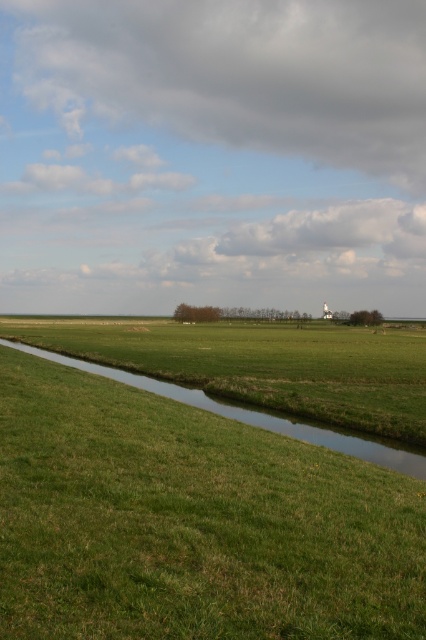
You are standing in the rural landscape and want to walk from the point at coordinates point (23, 420) to the point at coordinates point (169, 394). Considering the terrain described, will you have to climb uphill or downhill along the way?

Since point (23, 420) is in front of point (169, 394), you will be moving towards a higher elevation, so you will have to climb uphill.